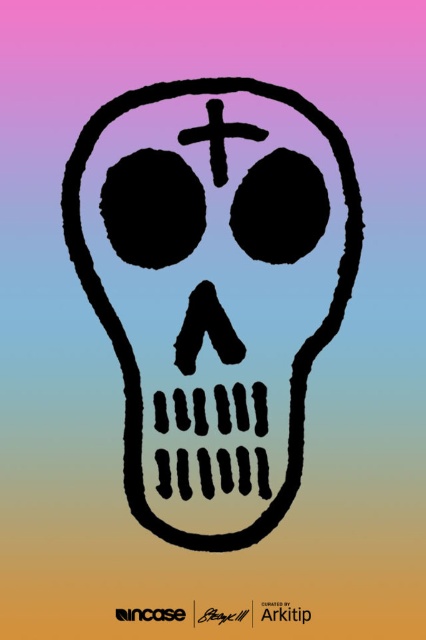
Question: Can you confirm if black matte skull at center is positioned to the left of black matte cross at center?

Choices:
 (A) yes
 (B) no

Answer: (A)

Question: Does black matte skull at center come behind black matte cross at center?

Choices:
 (A) yes
 (B) no

Answer: (B)

Question: Can you confirm if black matte skull at center is positioned to the left of black matte cross at center?

Choices:
 (A) yes
 (B) no

Answer: (A)

Question: Which point is closer to the camera taking this photo?

Choices:
 (A) (204, 132)
 (B) (135, 422)

Answer: (A)